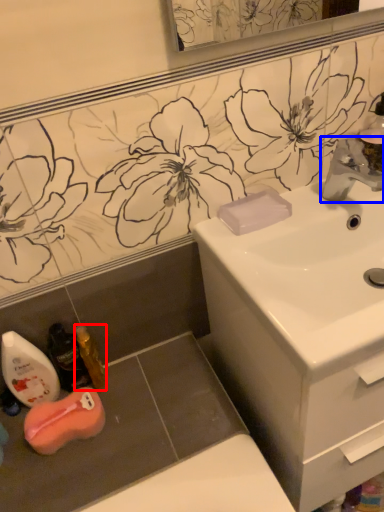
Question: Which object appears closest to the camera in this image, mouthwash (highlighted by a red box) or tap (highlighted by a blue box)?

Choices:
 (A) mouthwash
 (B) tap

Answer: (B)